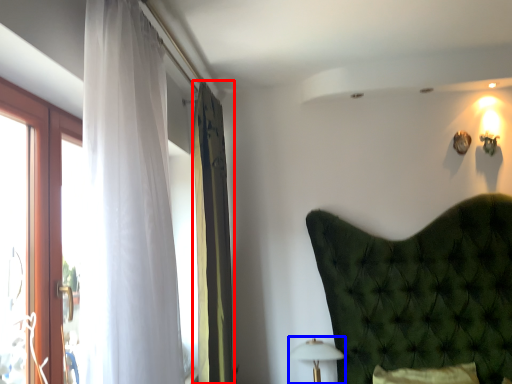
Question: Among these objects, which one is nearest to the camera, curtain (highlighted by a red box) or table lamp (highlighted by a blue box)?

Choices:
 (A) curtain
 (B) table lamp

Answer: (A)